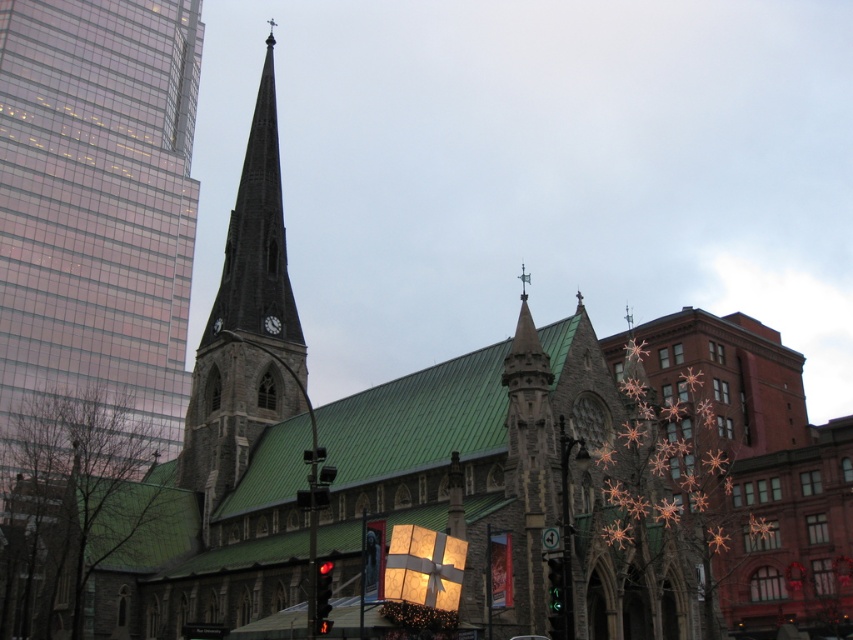
What do you see at coordinates (96, 205) in the screenshot? I see `glassy pink skyscraper at left` at bounding box center [96, 205].

Find the location of a particular element. This screenshot has width=853, height=640. glassy pink skyscraper at left is located at coordinates (96, 205).

Does point (268, 84) come farther from viewer compared to point (561, 577)?

Yes, point (268, 84) is farther from viewer.

Does dark gray stone tower at center-left have a greater width compared to green glass traffic light at center?

Correct, the width of dark gray stone tower at center-left exceeds that of green glass traffic light at center.

Is point (200, 440) closer to viewer compared to point (555, 573)?

That is False.

This screenshot has width=853, height=640. In order to click on dark gray stone tower at center-left in this screenshot , I will do `click(245, 323)`.

Does point (286, 326) lie in front of point (316, 624)?

No, (286, 326) is behind (316, 624).

Can you confirm if dark gray stone tower at center-left is thinner than red glass traffic light at lower center?

Incorrect, dark gray stone tower at center-left's width is not less than red glass traffic light at lower center's.

The height and width of the screenshot is (640, 853). In order to click on dark gray stone tower at center-left in this screenshot , I will do `click(245, 323)`.

The width and height of the screenshot is (853, 640). I want to click on dark gray stone tower at center-left, so click(245, 323).